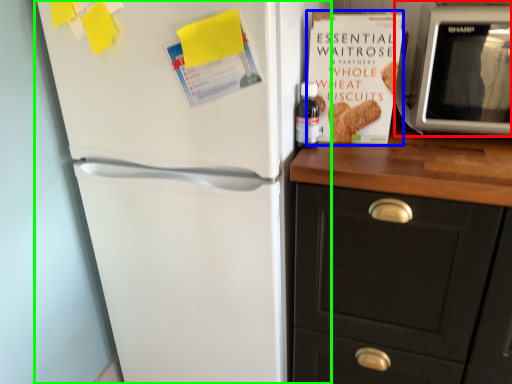
Question: Which is nearer to the microwave oven (highlighted by a red box)? paperback book (highlighted by a blue box) or refrigerator (highlighted by a green box).

Choices:
 (A) paperback book
 (B) refrigerator

Answer: (A)